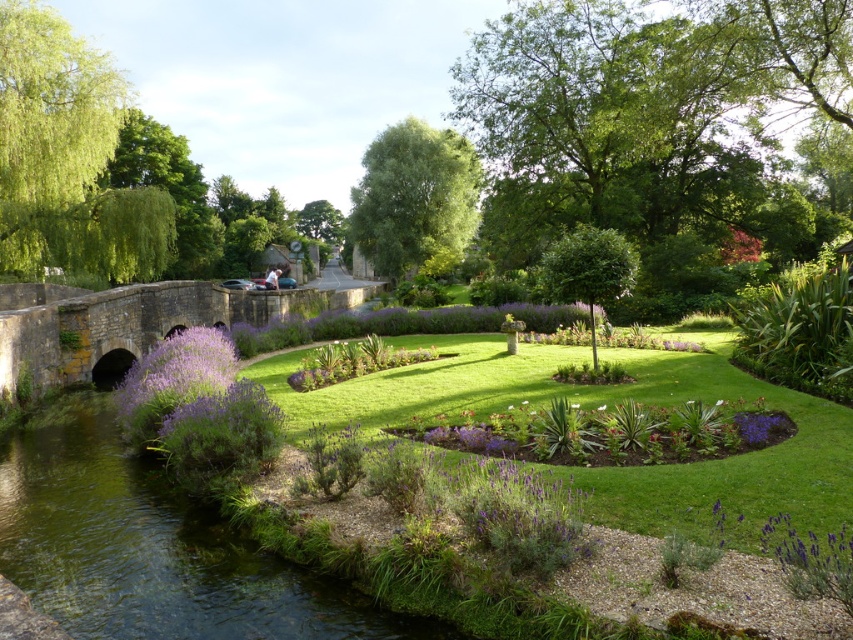
You are planning to place a small garden statue that requires a space of at least 1 meter in diameter. Based on the scene, which object between the green grassy stream at lower left and the purple matte flower at lower right would be suitable for placing the statue?

The green grassy stream at lower left has a larger size compared to the purple matte flower at lower right. Therefore, the statue would fit better at the location of the green grassy stream at lower left since it provides enough space.

You are standing in the garden and want to take a photo of both the point at coordinates (183, 582) and the point at coordinates (144, 403). Which point should you focus on first to ensure both are in focus?

You should focus on the point at coordinates (183, 582) first because it is closer to the camera than the point at coordinates (144, 403). This ensures both points will be in focus as the depth of field will cover the distance between them.

Based on the provided scene description, what are the coordinates of the green grassy stream at lower left?

The coordinates of the green grassy stream at lower left are at point (152,547).